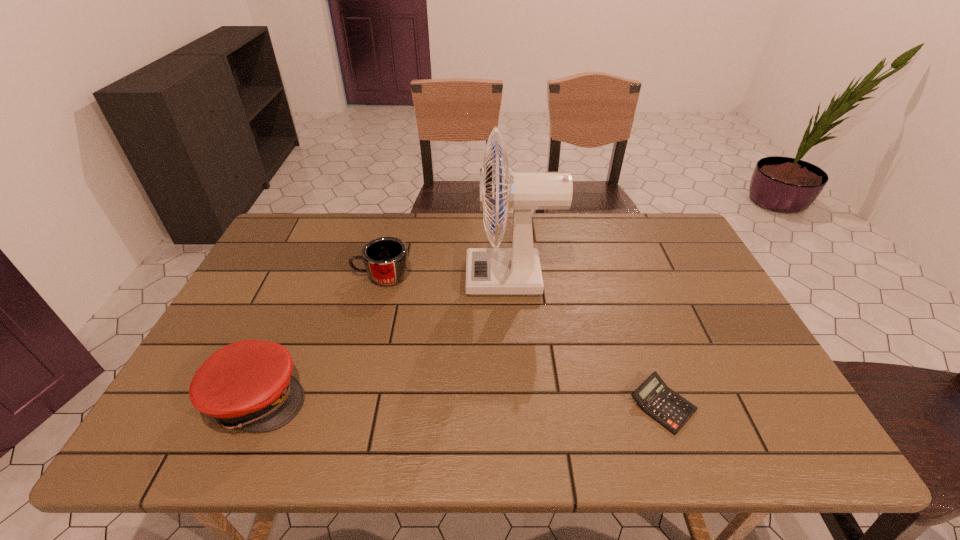
Locate an element on the screen. vacant region located on the side of the second object from left to right with the handle is located at coordinates (312, 276).

Locate an element on the screen. The width and height of the screenshot is (960, 540). vacant region located 0.160m on the side of the second object from left to right with the handle is located at coordinates (299, 276).

The image size is (960, 540). I want to click on vacant space positioned on the front of the leftmost object with an emblem, so click(438, 397).

The height and width of the screenshot is (540, 960). Find the location of `vacant point located on the left of the rightmost object`. vacant point located on the left of the rightmost object is located at coordinates (456, 405).

This screenshot has height=540, width=960. In order to click on object situated at the far edge in this screenshot , I will do `click(489, 271)`.

This screenshot has height=540, width=960. I want to click on cap at the near edge, so click(247, 385).

At what (x,y) coordinates should I click in order to perform the action: click on calculator that is at the near edge. Please return your answer as a coordinate pair (x, y). Looking at the image, I should click on (656, 399).

Identify the location of object present at the left edge. Image resolution: width=960 pixels, height=540 pixels. (247, 385).

You are a GUI agent. You are given a task and a screenshot of the screen. Output one action in this format:
    pyautogui.click(x=<x>, y=<y>)
    Task: Click on the object at the near left corner
    
    Given the screenshot: What is the action you would take?
    pyautogui.click(x=247, y=385)

In order to click on free location at the far edge of the desktop in this screenshot , I will do `click(380, 221)`.